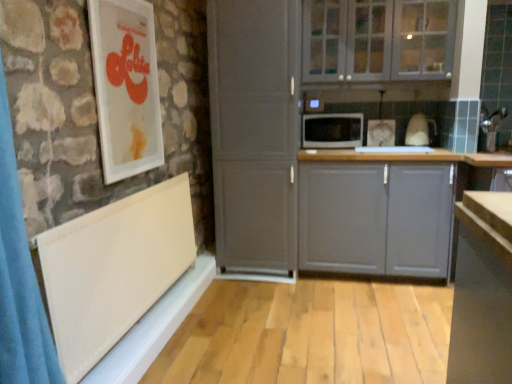
Find the location of a particular element. The height and width of the screenshot is (384, 512). vacant area that is in front of gray matte cabinet at center, which appears as the second cabinetry when viewed from the top is located at coordinates (372, 312).